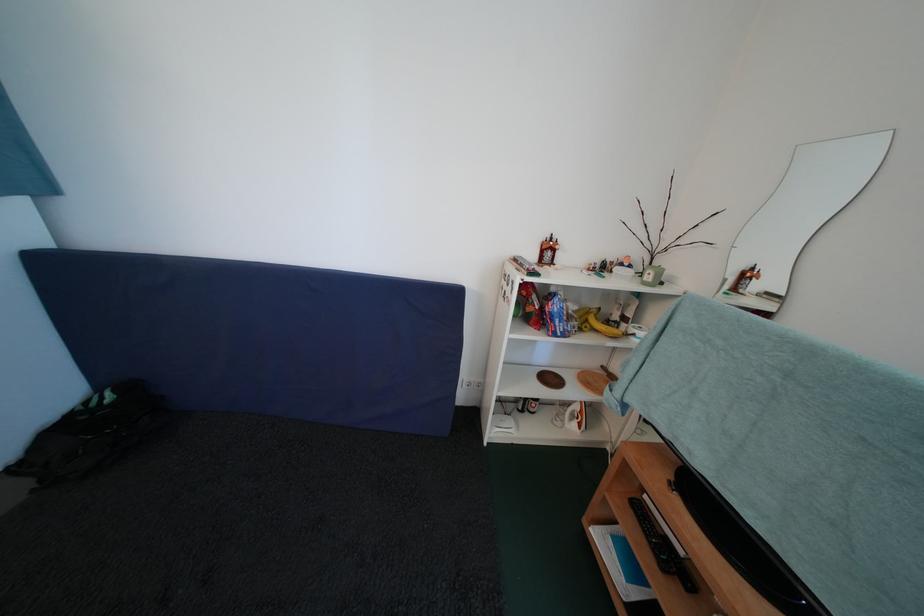
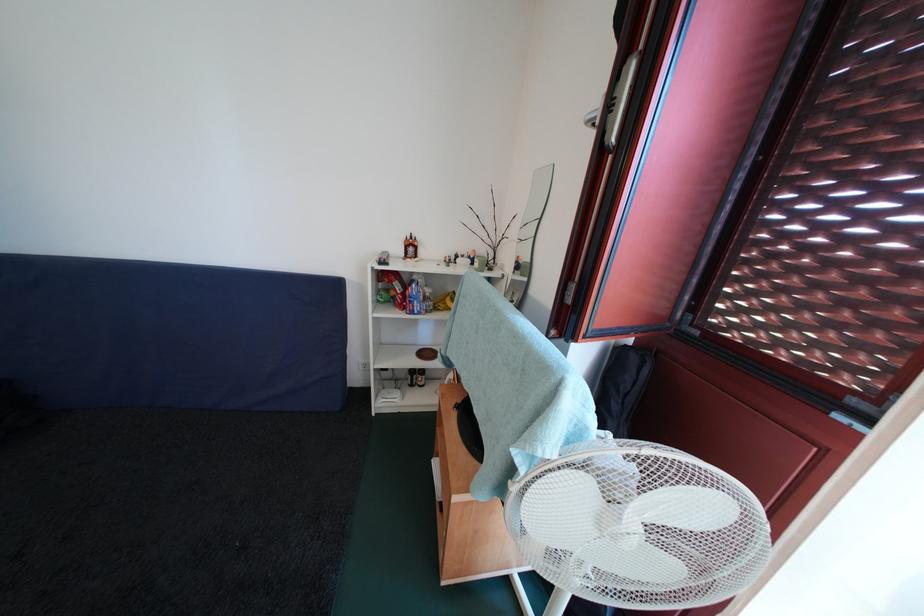
Find the pixel in the second image that matches the point at 582,313 in the first image.

(438, 296)